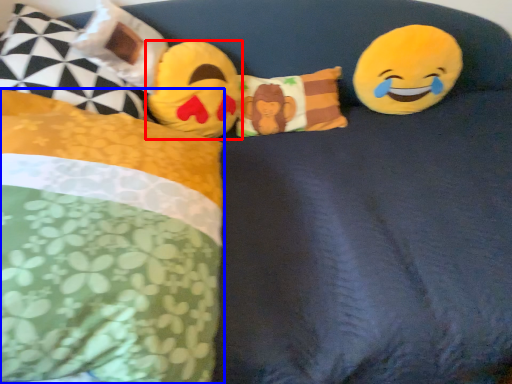
Question: Which point is closer to the camera, toy (highlighted by a red box) or pillow (highlighted by a blue box)?

Choices:
 (A) toy
 (B) pillow

Answer: (B)